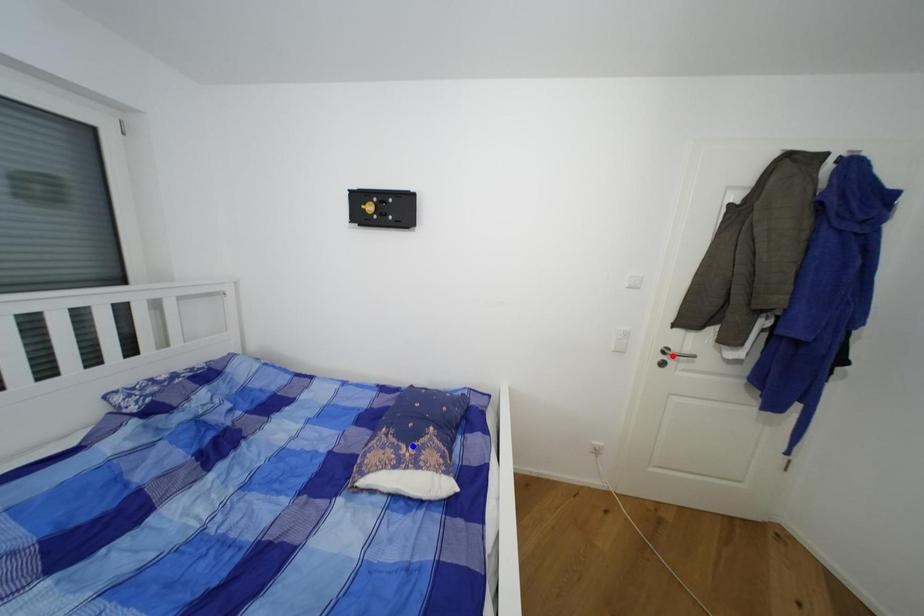
Question: Which of the two points in the image is closer to the camera?

Choices:
 (A) Blue point is closer.
 (B) Red point is closer.

Answer: (A)